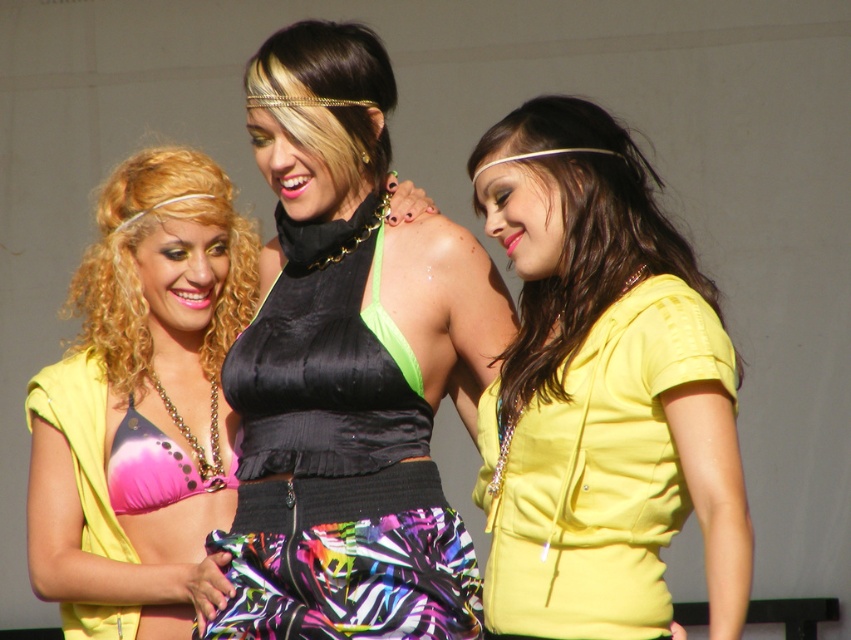
Question: Considering the real-world distances, which object is farthest from the matte black bikini top at center?

Choices:
 (A) satin black halter top at center
 (B) pink polka dot bikini top at left
 (C) pink satin bikini top at center

Answer: (A)

Question: Can you confirm if satin black halter top at center is wider than yellow matte hoodie at center?

Choices:
 (A) no
 (B) yes

Answer: (B)

Question: Which point is farther to the camera?

Choices:
 (A) (504, 508)
 (B) (210, 480)
 (C) (435, 397)

Answer: (B)

Question: In this image, where is pink polka dot bikini top at left located relative to pink satin bikini top at center?

Choices:
 (A) left
 (B) right

Answer: (A)

Question: Is satin black halter top at center below pink polka dot bikini top at left?

Choices:
 (A) no
 (B) yes

Answer: (A)

Question: Estimate the real-world distances between objects in this image. Which object is closer to the satin black halter top at center?

Choices:
 (A) matte black bikini top at center
 (B) pink satin bikini top at center
 (C) pink polka dot bikini top at left
 (D) yellow matte hoodie at center

Answer: (D)